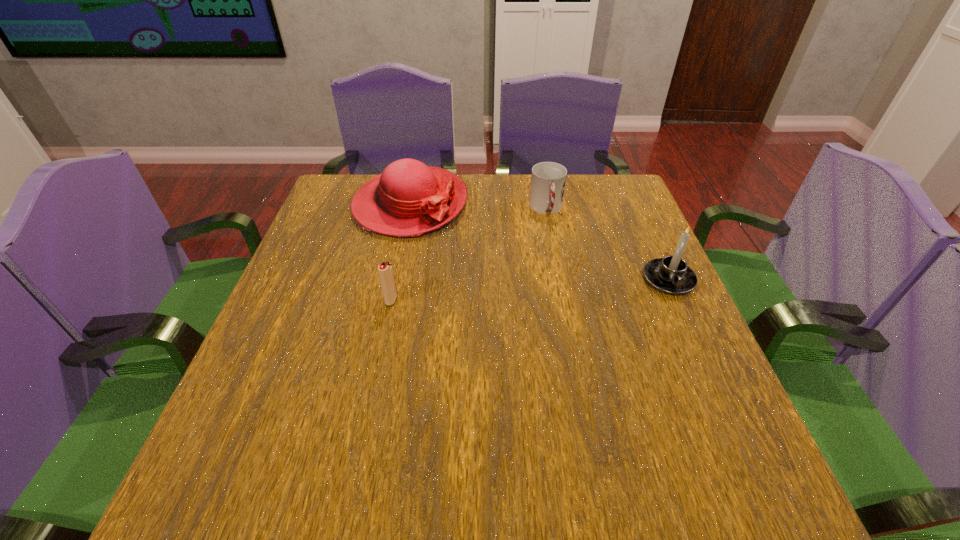
Where is `free space on the desktop that is between the igniter and the candle holder and is positioned at the front of the second tallest object with a bow`? free space on the desktop that is between the igniter and the candle holder and is positioned at the front of the second tallest object with a bow is located at coordinates (493, 293).

What are the coordinates of `vacant space on the desktop that is between the igniter and the tallest object and is positioned on the side of the third object from left to right where the handle is located` in the screenshot? It's located at (566, 287).